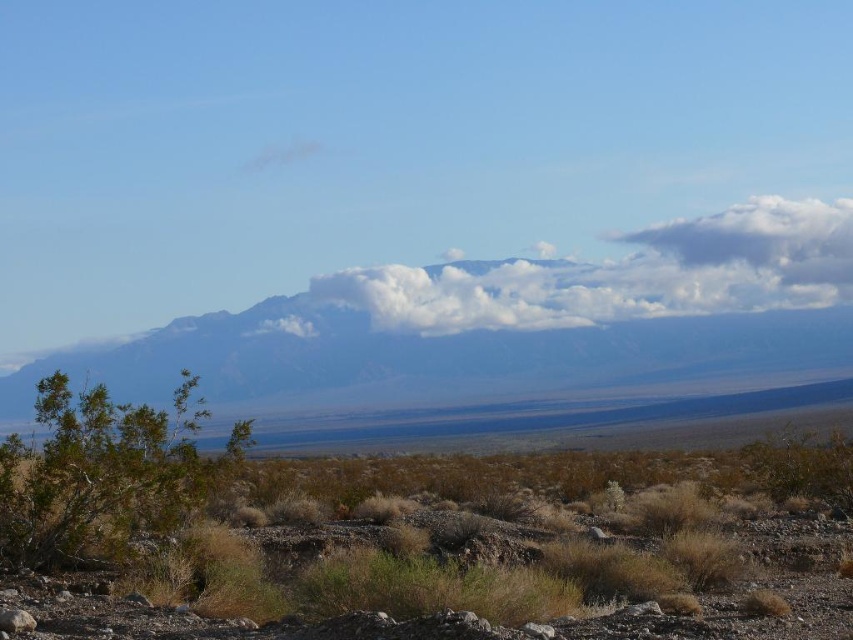
Which is behind, point (796, 624) or point (821, 259)?

The point (821, 259) is more distant.

Is brown dry grass at lower left below white fluffy cloud at center?

Correct, brown dry grass at lower left is located below white fluffy cloud at center.

Describe the element at coordinates (480, 554) in the screenshot. Image resolution: width=853 pixels, height=640 pixels. I see `brown dry grass at lower left` at that location.

Where is `brown dry grass at lower left`? The image size is (853, 640). brown dry grass at lower left is located at coordinates (480, 554).

Which is behind, point (693, 262) or point (61, 426)?

The point (693, 262) is behind.

This screenshot has height=640, width=853. I want to click on white fluffy cloud at center, so click(625, 275).

At what (x,y) coordinates should I click in order to perform the action: click on white fluffy cloud at center. Please return your answer as a coordinate pair (x, y). This screenshot has width=853, height=640. Looking at the image, I should click on (625, 275).

At what (x,y) coordinates should I click in order to perform the action: click on white fluffy cloud at center. Please return your answer as a coordinate pair (x, y). This screenshot has width=853, height=640. Looking at the image, I should click on (625, 275).

Based on the photo, measure the distance between point (527, 518) and camera.

They are 21.59 meters apart.

Who is more forward, (502, 515) or (91, 540)?

Point (91, 540) is more forward.

Is point (695, 480) less distant than point (103, 500)?

That is False.

The image size is (853, 640). I want to click on brown dry grass at lower left, so click(480, 554).